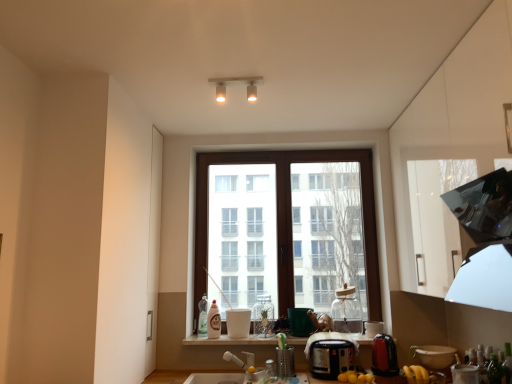
Question: Is matte white light fixture at upper center oriented away from white glossy cup at center, which appears as the 1th appliance when viewed from the left?

Choices:
 (A) no
 (B) yes

Answer: (A)

Question: Is the position of matte white light fixture at upper center more distant than that of white glossy cup at center, marked as the sixth appliance in a right-to-left arrangement?

Choices:
 (A) yes
 (B) no

Answer: (B)

Question: Would you say white glossy cup at center, marked as the sixth appliance in a right-to-left arrangement, is part of matte white light fixture at upper center's contents?

Choices:
 (A) no
 (B) yes

Answer: (A)

Question: Is matte white light fixture at upper center oriented towards white glossy cup at center, marked as the sixth appliance in a right-to-left arrangement?

Choices:
 (A) yes
 (B) no

Answer: (B)

Question: Does matte white light fixture at upper center have a lesser width compared to white glossy cup at center, which appears as the 1th appliance when viewed from the left?

Choices:
 (A) yes
 (B) no

Answer: (A)

Question: Is matte white light fixture at upper center shorter than white glossy cup at center, which appears as the 1th appliance when viewed from the left?

Choices:
 (A) no
 (B) yes

Answer: (B)

Question: Is black plastic toaster at center, the 4th appliance viewed from the right, behind white glossy window sill at lower center?

Choices:
 (A) no
 (B) yes

Answer: (A)

Question: Would you consider black plastic toaster at center, the 4th appliance viewed from the right, to be distant from white glossy window sill at lower center?

Choices:
 (A) yes
 (B) no

Answer: (B)

Question: Considering the relative sizes of black plastic toaster at center, the third appliance viewed from the left, and white glossy window sill at lower center in the image provided, is black plastic toaster at center, the third appliance viewed from the left, shorter than white glossy window sill at lower center?

Choices:
 (A) no
 (B) yes

Answer: (A)

Question: Does black plastic toaster at center, the 4th appliance viewed from the right, have a greater height compared to white glossy window sill at lower center?

Choices:
 (A) no
 (B) yes

Answer: (B)

Question: Can you confirm if black plastic toaster at center, the 4th appliance viewed from the right, is positioned to the right of white glossy window sill at lower center?

Choices:
 (A) yes
 (B) no

Answer: (A)

Question: Is black plastic toaster at center, the third appliance viewed from the left, completely or partially outside of white glossy window sill at lower center?

Choices:
 (A) no
 (B) yes

Answer: (B)

Question: Considering the relative sizes of white glossy bottle at center, the 3th bottle from the right, and white glossy cup at center, which appears as the 1th appliance when viewed from the left, in the image provided, is white glossy bottle at center, the 3th bottle from the right, shorter than white glossy cup at center, which appears as the 1th appliance when viewed from the left,?

Choices:
 (A) yes
 (B) no

Answer: (B)